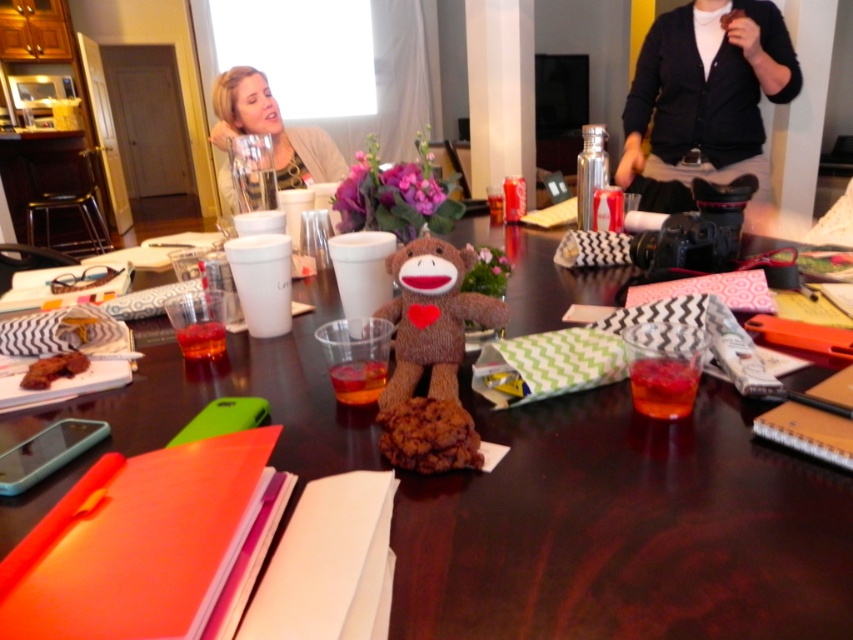
You are organizing a small party and need to place a large centerpiece on the table. Given the sizes of the brown fabric table at center and the black cardigan at upper right, which object would be more suitable to accommodate the centerpiece?

The brown fabric table at center is larger in size than the black cardigan at upper right, so the brown fabric table at center would be more suitable to accommodate the centerpiece.

You are organizing a small party and need to place a decorative item on the table. You have a matte beige sweater at upper left and a baked chocolate cookie at center. According to the image, which item is positioned to the left of the other?

The matte beige sweater at upper left is to the left of the baked chocolate cookie at center.